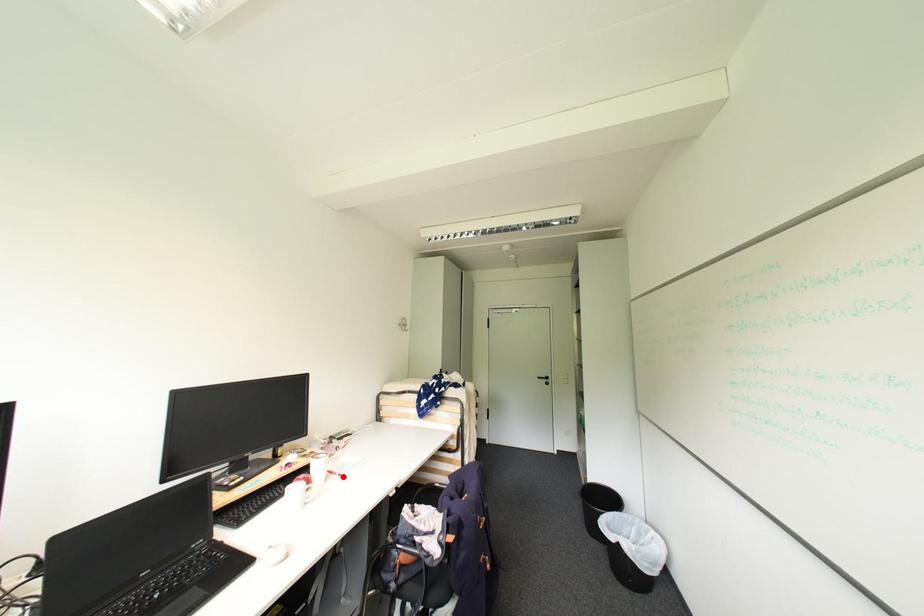
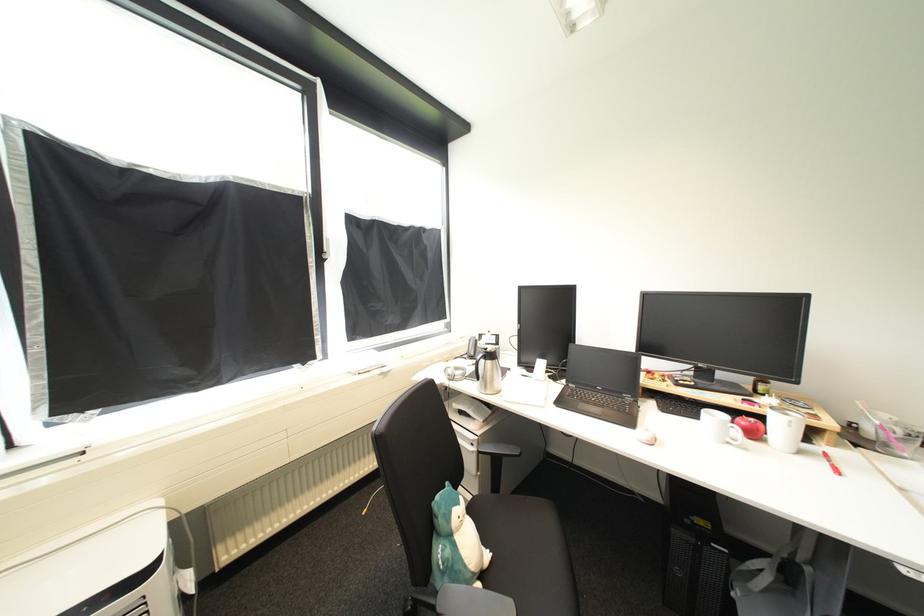
Locate, in the second image, the point that corresponds to the highlighted location in the first image.

(834, 464)